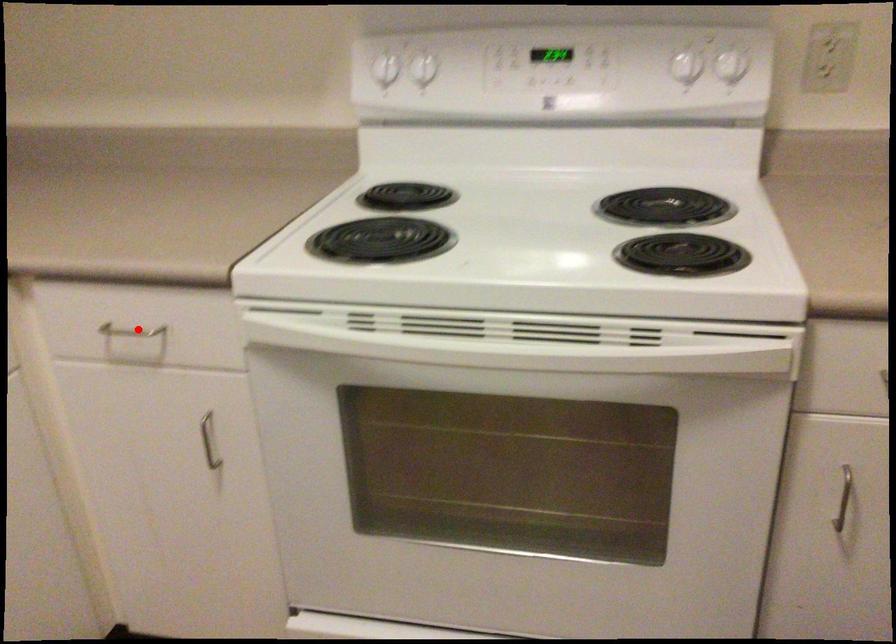
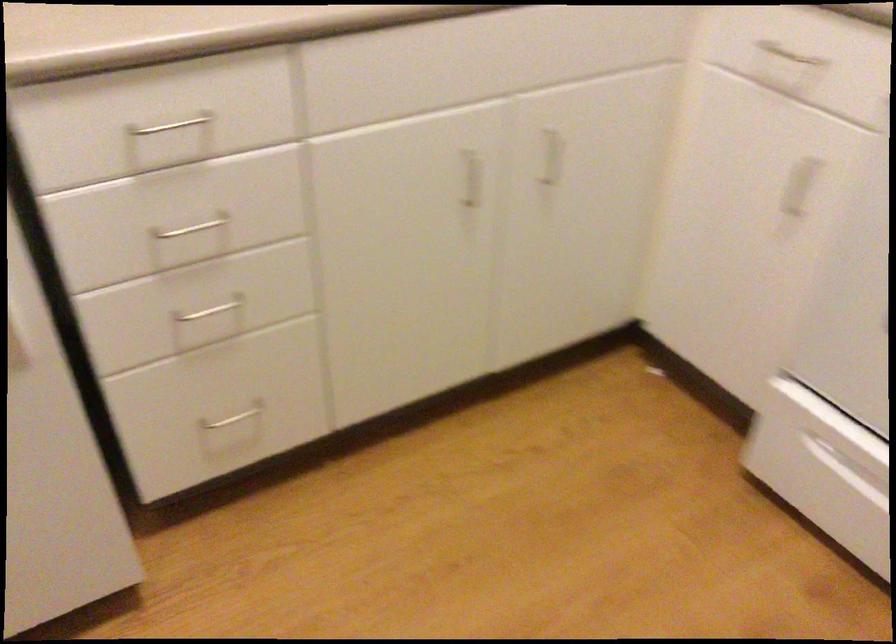
Where in the second image is the point corresponding to the highlighted location from the first image?

(789, 55)